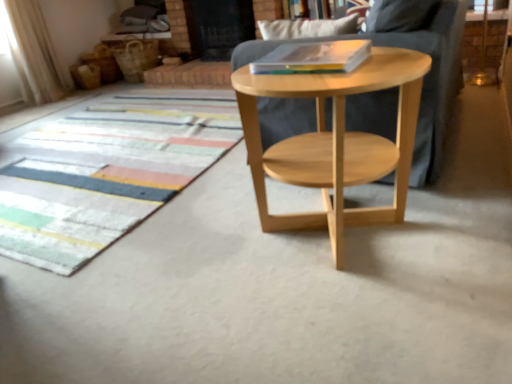
Find the location of a particular element. Image resolution: width=512 pixels, height=384 pixels. vacant point above multicolored woven mat at lower left (from a real-world perspective) is located at coordinates (109, 141).